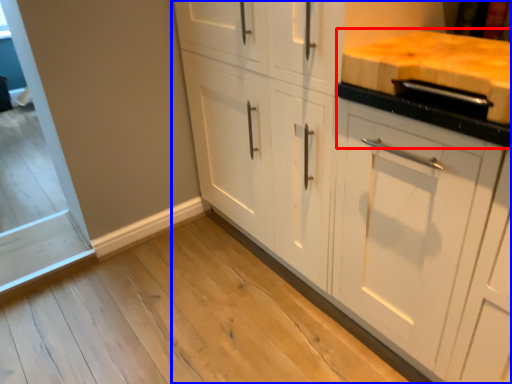
Question: Which of the following is the closest to the observer, countertop (highlighted by a red box) or cabinetry (highlighted by a blue box)?

Choices:
 (A) countertop
 (B) cabinetry

Answer: (A)